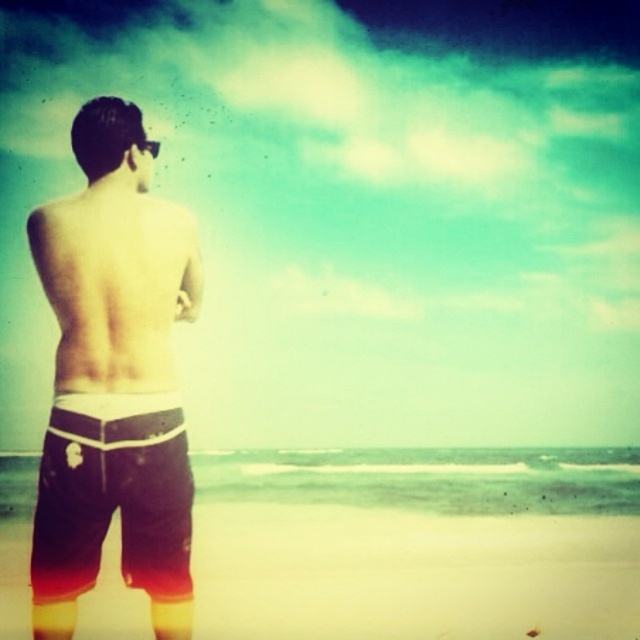
Question: Observing the image, what is the correct spatial positioning of dark brown shorts at left in reference to beige sand at lower center?

Choices:
 (A) above
 (B) below

Answer: (A)

Question: Which point is farther to the camera?

Choices:
 (A) dark brown shorts at left
 (B) beige sand at lower center

Answer: (B)

Question: Can you confirm if dark brown shorts at left is wider than beige sand at lower center?

Choices:
 (A) no
 (B) yes

Answer: (A)

Question: Is dark brown shorts at left above beige sand at lower center?

Choices:
 (A) no
 (B) yes

Answer: (B)

Question: Among these points, which one is nearest to the camera?

Choices:
 (A) (452, 552)
 (B) (74, 211)

Answer: (B)